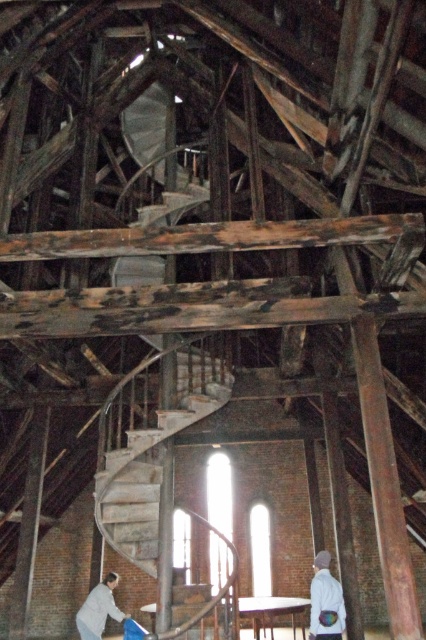
Does point (328, 570) lie behind point (86, 637)?

No, (328, 570) is closer to viewer.

Is white matte jacket at lower right below light gray fabric at lower left?

No, white matte jacket at lower right is not below light gray fabric at lower left.

Identify the location of white matte jacket at lower right. This screenshot has height=640, width=426. (325, 602).